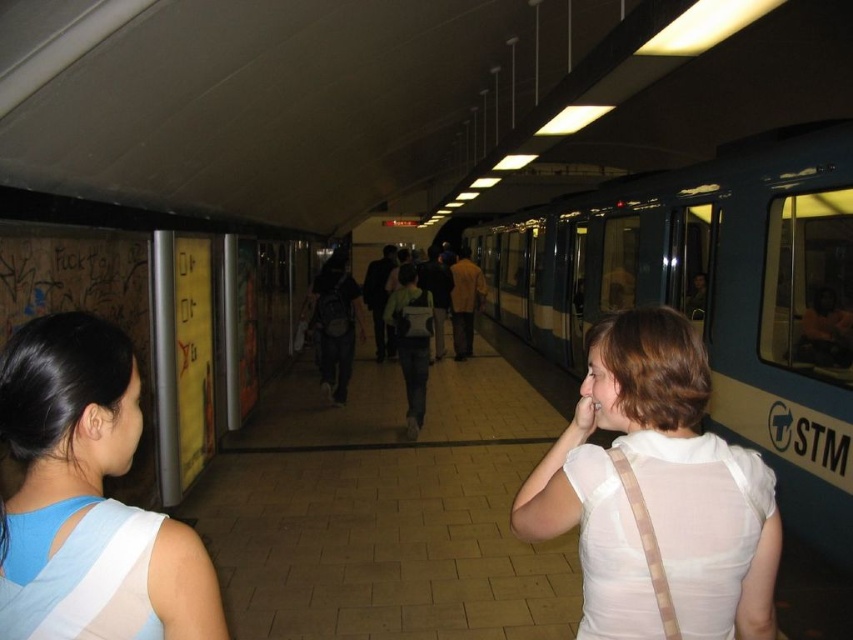
You are a passenger waiting at the subway station platform. You notice a blue metallic train at center and a blue fabric shirt at left. Which object is closer to you, the observer?

The blue metallic train at center is closer to you than the blue fabric shirt at left because it is positioned over it.

You are standing on the subway platform and want to board the blue metallic train at center. Based on the coordinates provided, where exactly should you position yourself to board the train?

The blue metallic train at center is located at coordinates point (717, 296), so you should position yourself at that point to board the train.

You are a passenger waiting on the subway platform. You notice a white sheer blouse at center and a blue metallic train at center. Which object is closer to you?

The blue metallic train at center is closer to you because the white sheer blouse at center is behind it.